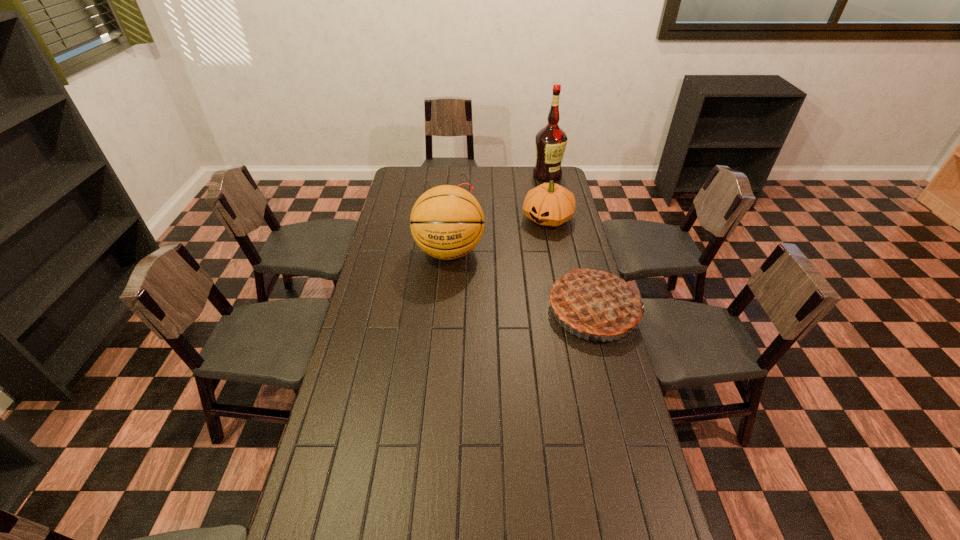
Where is `vacant region at the near left corner of the desktop`? This screenshot has width=960, height=540. vacant region at the near left corner of the desktop is located at coordinates (297, 536).

You are a GUI agent. You are given a task and a screenshot of the screen. Output one action in this format:
    pyautogui.click(x=<x>, y=<y>)
    Task: Click on the vacant space at the near right corner of the desktop
    The image size is (960, 540).
    Given the screenshot: What is the action you would take?
    pyautogui.click(x=660, y=532)

Locate an element on the screen. The image size is (960, 540). empty location between the shortest object and the third tallest object is located at coordinates (521, 249).

Where is `vacant space in between the alcohol and the spectacles`? The width and height of the screenshot is (960, 540). vacant space in between the alcohol and the spectacles is located at coordinates (498, 183).

At what (x,y) coordinates should I click in order to perform the action: click on vacant area between the spectacles and the second shortest object. Please return your answer as a coordinate pair (x, y). Looking at the image, I should click on (498, 204).

You are a GUI agent. You are given a task and a screenshot of the screen. Output one action in this format:
    pyautogui.click(x=<x>, y=<y>)
    Task: Click on the empty location between the alcohol and the spectacles
    The width and height of the screenshot is (960, 540).
    Given the screenshot: What is the action you would take?
    pyautogui.click(x=498, y=183)

Where is `vacant area between the basketball and the tallest object`? The height and width of the screenshot is (540, 960). vacant area between the basketball and the tallest object is located at coordinates click(x=498, y=213).

The width and height of the screenshot is (960, 540). What are the coordinates of `free space between the basketball and the gourd` in the screenshot? It's located at (498, 235).

Image resolution: width=960 pixels, height=540 pixels. I want to click on blank region between the spectacles and the gourd, so click(x=498, y=204).

The height and width of the screenshot is (540, 960). What are the coordinates of `free area in between the basketball and the nearest object` in the screenshot? It's located at (521, 280).